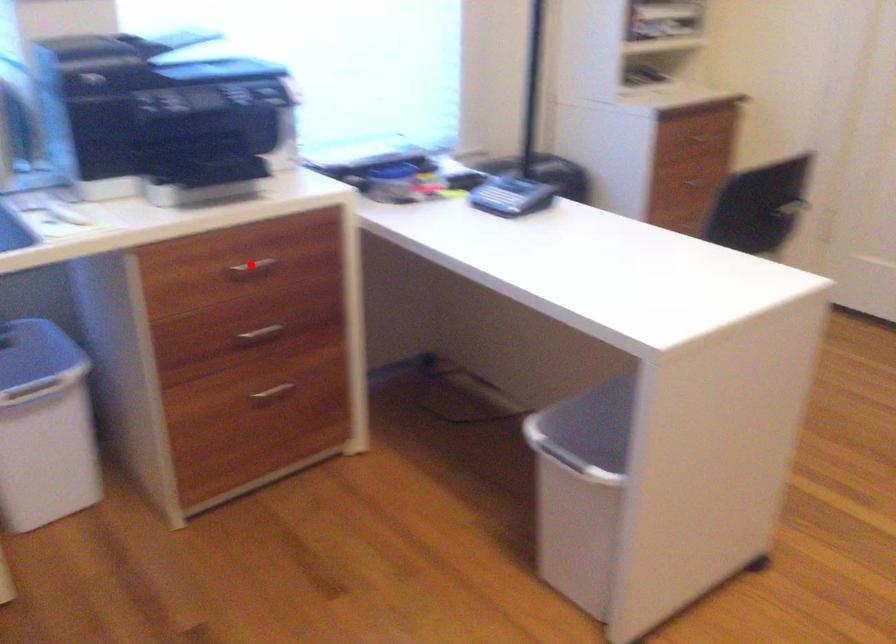
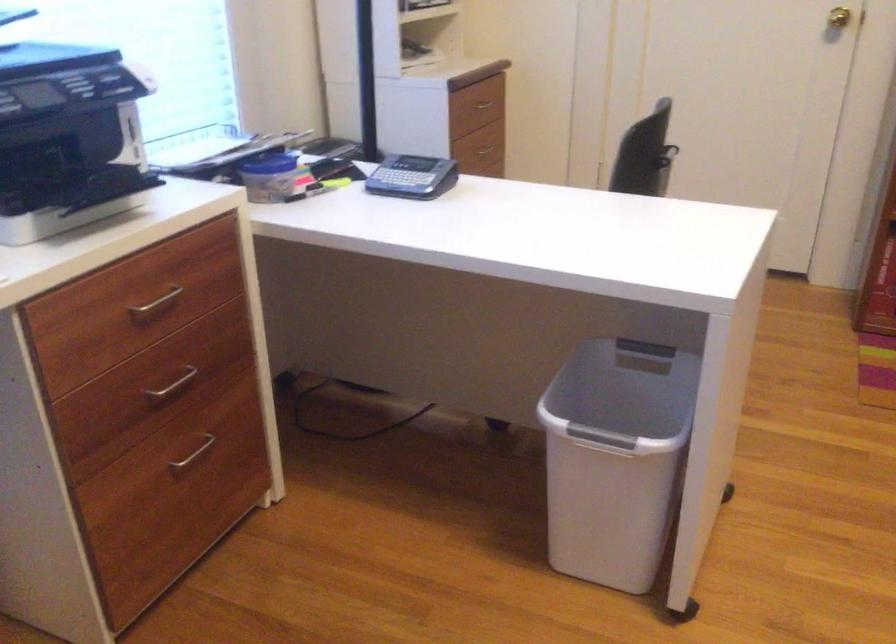
Find the pixel in the second image that matches the highlighted location in the first image.

(156, 303)